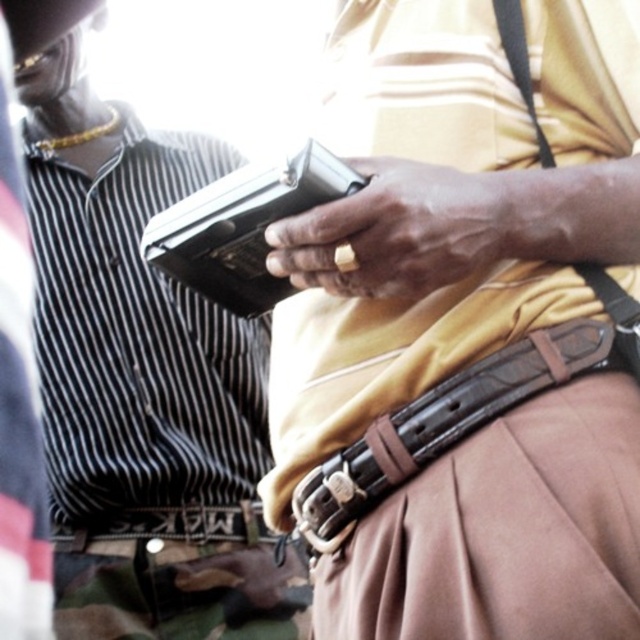
Is matte black wallet at left to the left of brown leather belt at lower center from the viewer's perspective?

Yes, matte black wallet at left is to the left of brown leather belt at lower center.

Can you confirm if matte black wallet at left is bigger than brown leather belt at lower center?

Yes, matte black wallet at left is bigger than brown leather belt at lower center.

Is point (150, 451) positioned behind point (124, 536)?

That is True.

The image size is (640, 640). I want to click on matte black wallet at left, so click(x=141, y=384).

Who is taller, matte khaki pants at center or metallic gun at center?

matte khaki pants at center

Can you confirm if matte khaki pants at center is wider than metallic gun at center?

Correct, the width of matte khaki pants at center exceeds that of metallic gun at center.

Locate an element on the screen. matte khaki pants at center is located at coordinates (467, 328).

The image size is (640, 640). What do you see at coordinates (444, 424) in the screenshot? I see `brown leather belt at center` at bounding box center [444, 424].

Is point (532, 392) positioned before point (241, 200)?

Yes, it is in front of point (241, 200).

You are a GUI agent. You are given a task and a screenshot of the screen. Output one action in this format:
    pyautogui.click(x=<x>, y=<y>)
    Task: Click on the brown leather belt at center
    
    Given the screenshot: What is the action you would take?
    pyautogui.click(x=444, y=424)